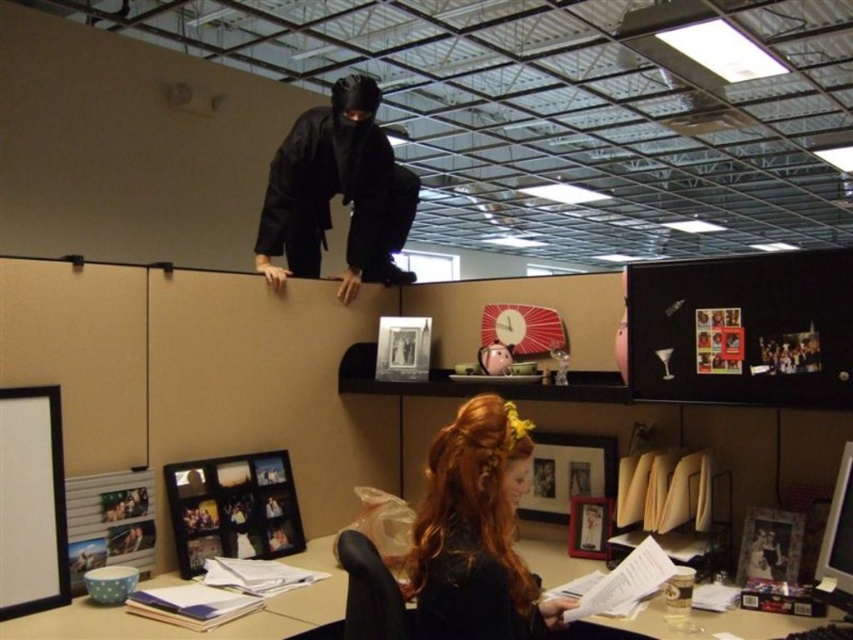
Question: Which point is farther to the camera?

Choices:
 (A) shiny brown hair at lower center
 (B) wooden desk at lower center

Answer: (B)

Question: Is shiny brown hair at lower center positioned at the back of wooden desk at lower center?

Choices:
 (A) yes
 (B) no

Answer: (B)

Question: Which point is closer to the camera taking this photo?

Choices:
 (A) (270, 205)
 (B) (511, 452)
 (C) (105, 627)

Answer: (B)

Question: Can you confirm if shiny brown hair at lower center is positioned to the left of wooden desk at lower center?

Choices:
 (A) yes
 (B) no

Answer: (B)

Question: Which point is farther to the camera?

Choices:
 (A) wooden desk at lower center
 (B) black matte ninja at upper center
 (C) shiny brown hair at lower center

Answer: (B)

Question: Does shiny brown hair at lower center appear over wooden desk at lower center?

Choices:
 (A) no
 (B) yes

Answer: (B)